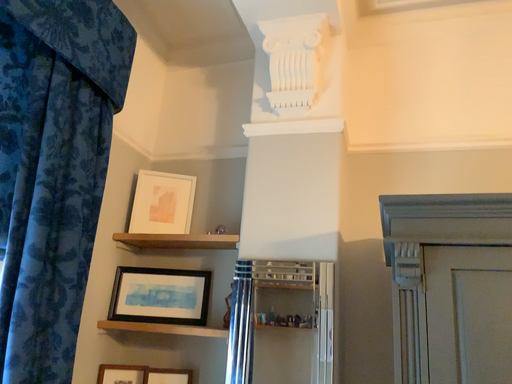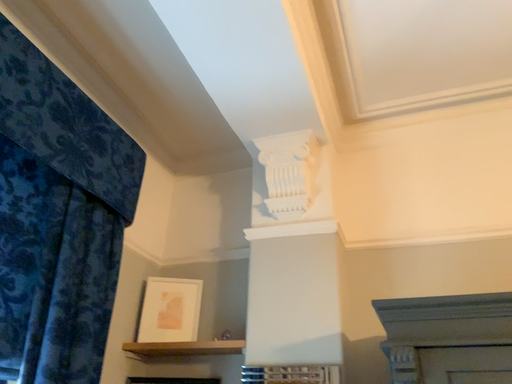
Question: Which way did the camera rotate in the video?

Choices:
 (A) rotated upward
 (B) rotated downward

Answer: (A)